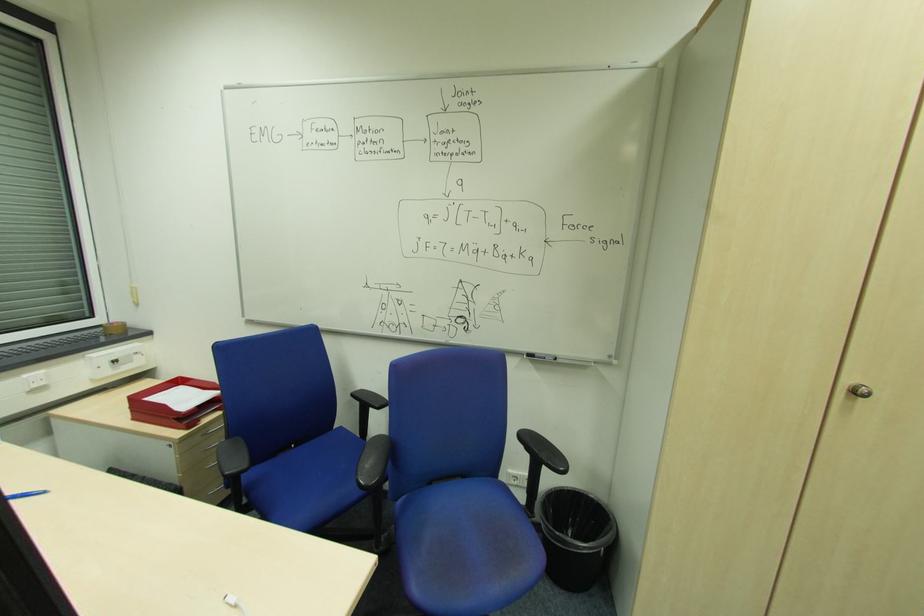
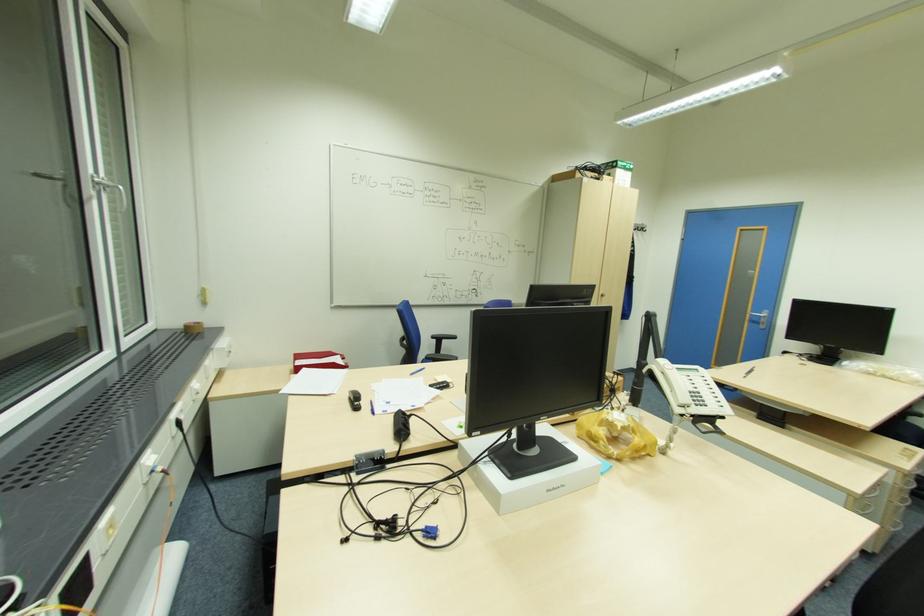
In the second image, find the point that corresponds to pixel 860 392 in the first image.

(604, 294)